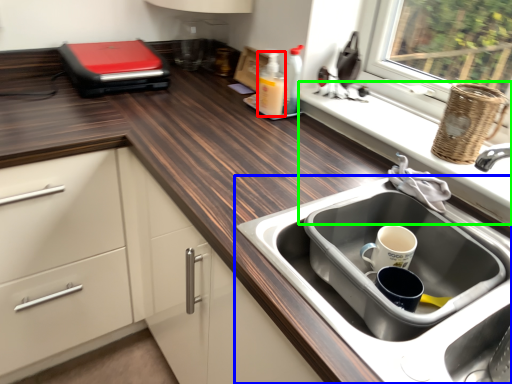
Question: Which object is positioned closest to bottle (highlighted by a red box)? Select from sink (highlighted by a blue box) and window sill (highlighted by a green box).

Choices:
 (A) sink
 (B) window sill

Answer: (B)